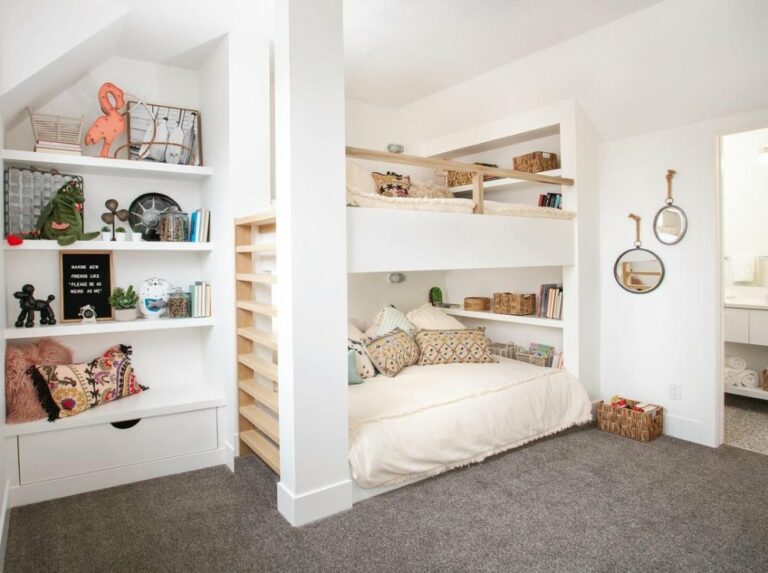
Where is `carpet`? Image resolution: width=768 pixels, height=573 pixels. carpet is located at coordinates (643, 514), (184, 524).